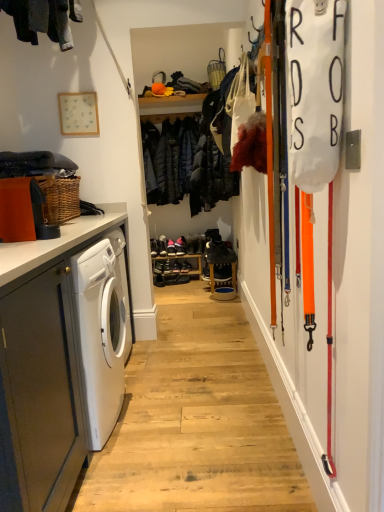
Question: Is matte gray cabinet at left to the left of matte black basket at upper center from the viewer's perspective?

Choices:
 (A) yes
 (B) no

Answer: (A)

Question: From the image's perspective, is matte gray cabinet at left located above matte black basket at upper center?

Choices:
 (A) no
 (B) yes

Answer: (A)

Question: Is matte gray cabinet at left outside matte black basket at upper center?

Choices:
 (A) no
 (B) yes

Answer: (B)

Question: Is matte gray cabinet at left oriented towards matte black basket at upper center?

Choices:
 (A) no
 (B) yes

Answer: (A)

Question: Is matte gray cabinet at left taller than matte black basket at upper center?

Choices:
 (A) yes
 (B) no

Answer: (A)

Question: From the image's perspective, is dark blue quilted jacket at center, positioned as the second clothing in front-to-back order, located above or below matte black basket at upper center?

Choices:
 (A) below
 (B) above

Answer: (A)

Question: Is dark blue quilted jacket at center, marked as the second clothing in a left-to-right arrangement, wider or thinner than matte black basket at upper center?

Choices:
 (A) thin
 (B) wide

Answer: (B)

Question: Is point (183, 128) positioned closer to the camera than point (216, 68)?

Choices:
 (A) closer
 (B) farther

Answer: (B)

Question: From a real-world perspective, is dark blue quilted jacket at center, marked as the first clothing in a right-to-left arrangement, positioned above or below matte black basket at upper center?

Choices:
 (A) above
 (B) below

Answer: (B)

Question: In terms of size, does dark gray fabric at left, which ranks as the first clothing in left-to-right order, appear bigger or smaller than matte gray cabinet at left?

Choices:
 (A) small
 (B) big

Answer: (A)

Question: Is dark gray fabric at left, which ranks as the first clothing in left-to-right order, wider or thinner than matte gray cabinet at left?

Choices:
 (A) thin
 (B) wide

Answer: (A)

Question: Do you think dark gray fabric at left, the first clothing positioned from the front, is within matte gray cabinet at left, or outside of it?

Choices:
 (A) outside
 (B) inside

Answer: (A)

Question: From a real-world perspective, relative to matte gray cabinet at left, is dark gray fabric at left, the first clothing positioned from the front, vertically above or below?

Choices:
 (A) below
 (B) above

Answer: (B)

Question: From a real-world perspective, is dark blue quilted jacket at center, the first clothing positioned from the back, above or below dark gray fabric at left, which is the 2th clothing in back-to-front order?

Choices:
 (A) below
 (B) above

Answer: (A)

Question: Choose the correct answer: Is dark blue quilted jacket at center, marked as the first clothing in a right-to-left arrangement, inside dark gray fabric at left, which is the 2th clothing in back-to-front order, or outside it?

Choices:
 (A) inside
 (B) outside

Answer: (B)